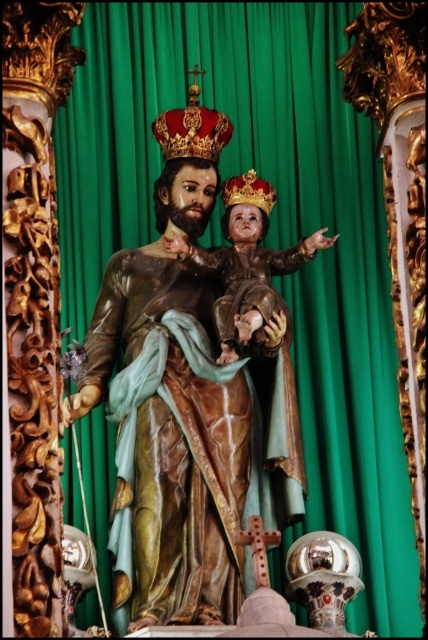
Is point (181, 112) farther from viewer compared to point (259, 577)?

Yes.

Does shiny red crown at upper center come behind wooden cross at center?

Yes, shiny red crown at upper center is behind wooden cross at center.

Which is in front, point (223, 113) or point (253, 536)?

Point (253, 536) is more forward.

The width and height of the screenshot is (428, 640). I want to click on shiny red crown at upper center, so click(x=192, y=129).

Can you confirm if gold textured crown at center is smaller than wooden cross at center?

Yes, gold textured crown at center is smaller than wooden cross at center.

This screenshot has width=428, height=640. What do you see at coordinates (249, 192) in the screenshot? I see `gold textured crown at center` at bounding box center [249, 192].

Is point (255, 204) more distant than point (261, 531)?

Yes, point (255, 204) is farther from viewer.

The height and width of the screenshot is (640, 428). Find the location of `gold textured crown at center`. gold textured crown at center is located at coordinates (249, 192).

Between shiny red crown at upper center and gold textured crown at center, which one appears on the right side from the viewer's perspective?

Positioned to the right is gold textured crown at center.

Can you confirm if shiny red crown at upper center is positioned to the left of gold textured crown at center?

Yes, shiny red crown at upper center is to the left of gold textured crown at center.

Is point (155, 132) more distant than point (231, 205)?

Yes.

Identify the location of shiny red crown at upper center. (192, 129).